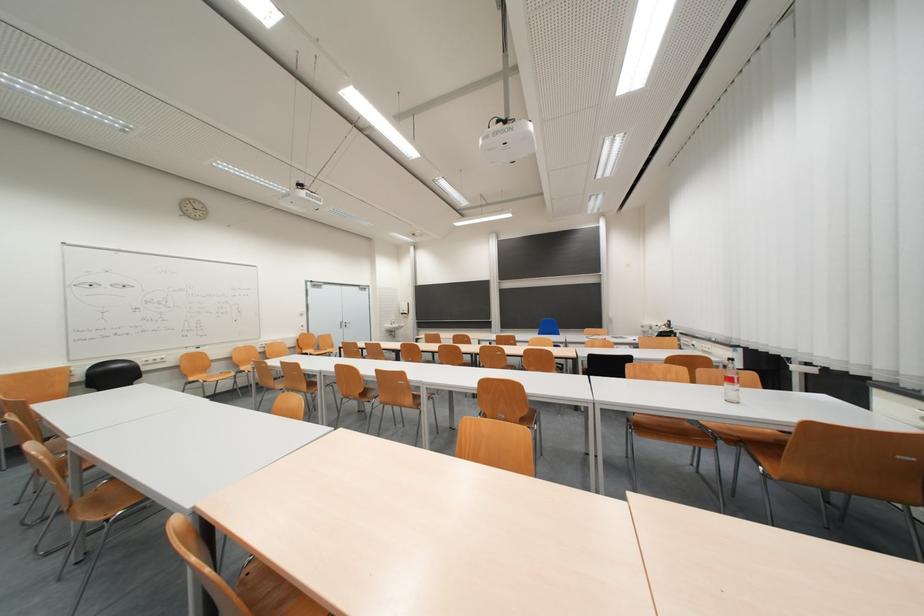
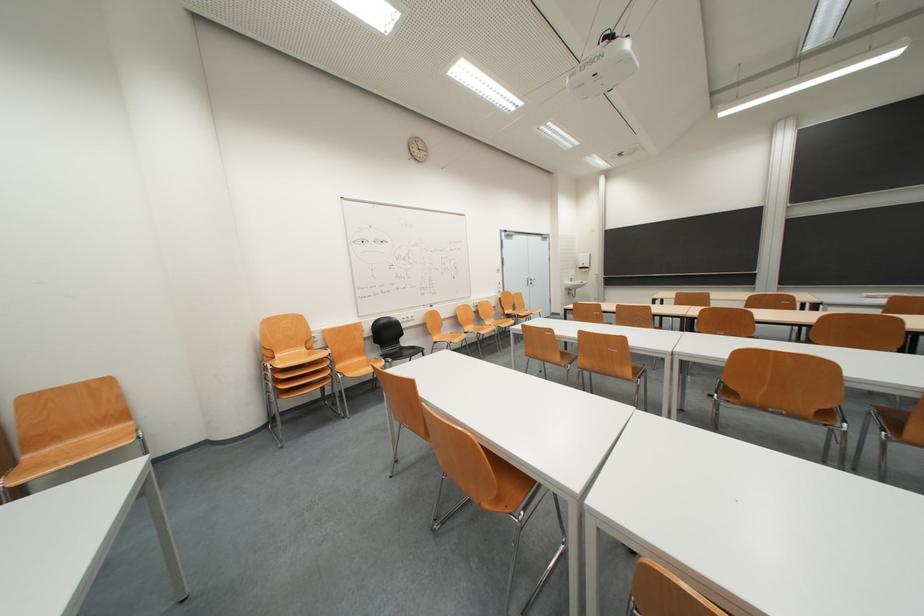
In the second image, find the point that corresponds to (395,331) in the first image.

(575, 288)